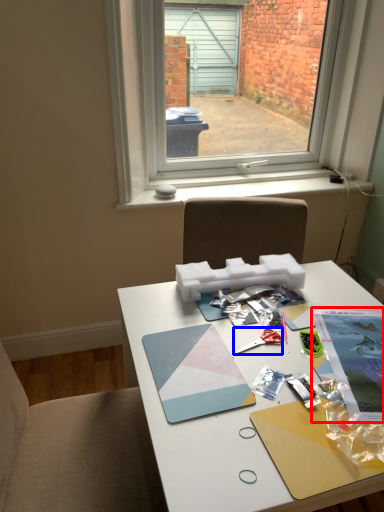
Question: Among these objects, which one is nearest to the camera, magazine (highlighted by a red box) or scissors (highlighted by a blue box)?

Choices:
 (A) magazine
 (B) scissors

Answer: (A)